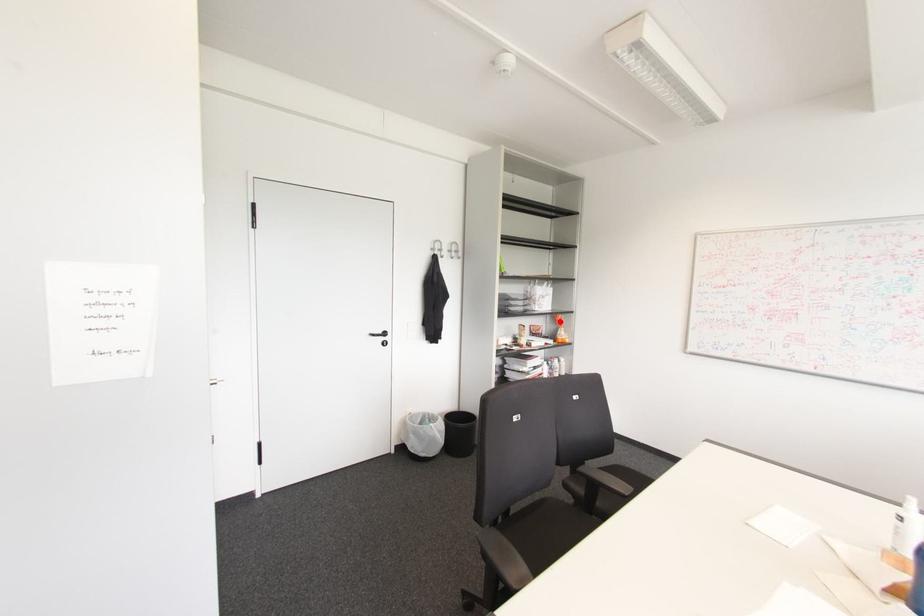
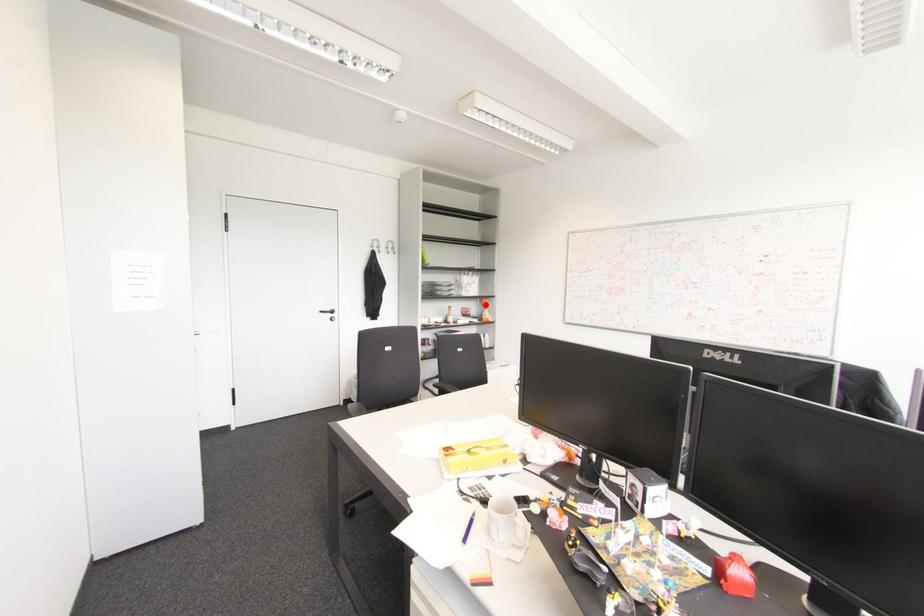
I am providing you with two images of the same scene from different viewpoints. A red point is marked on the first image and another point is marked on the second image. Does the point marked in image1 correspond to the same location as the one in image2?

Yes